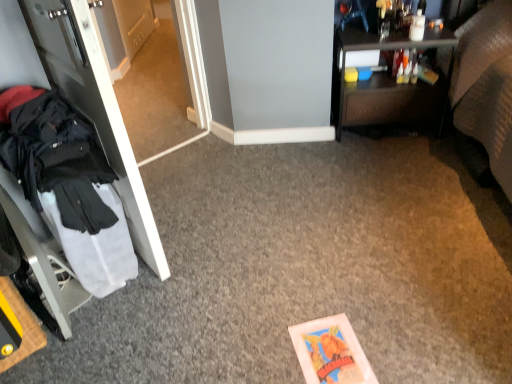
Question: From a real-world perspective, is transparent glass door at left physically located above or below white glossy door at left?

Choices:
 (A) above
 (B) below

Answer: (B)

Question: Would you say transparent glass door at left is to the left or to the right of white glossy door at left in the picture?

Choices:
 (A) right
 (B) left

Answer: (A)

Question: Estimate the real-world distances between objects in this image. Which object is farther from the black fabric coat at left?

Choices:
 (A) white glossy door at left
 (B) transparent glass door at left
 (C) dark brown wood desk at upper right

Answer: (C)

Question: Based on their relative distances, which object is nearer to the dark brown wood desk at upper right?

Choices:
 (A) black fabric coat at left
 (B) transparent glass door at left
 (C) white glossy door at left

Answer: (B)